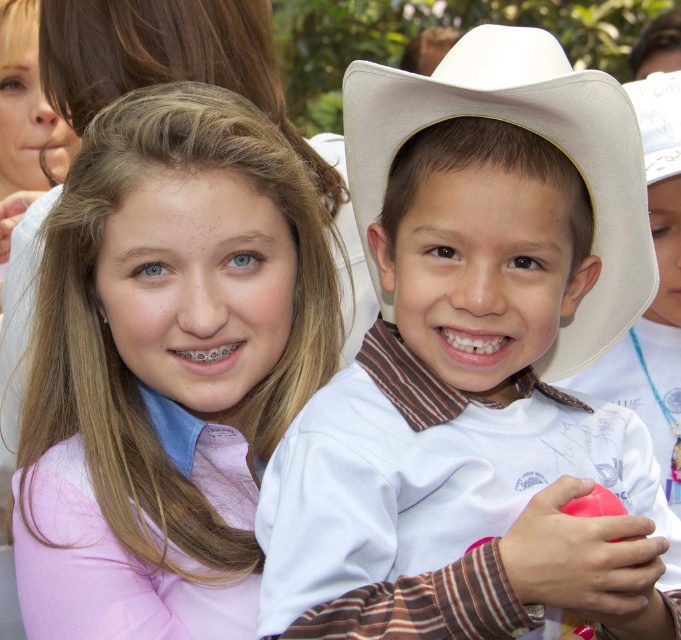
Does pink fabric shirt at upper left have a greater width compared to white cotton cowboy hat at center?

Yes, pink fabric shirt at upper left is wider than white cotton cowboy hat at center.

What do you see at coordinates (165, 368) in the screenshot?
I see `pink fabric shirt at upper left` at bounding box center [165, 368].

This screenshot has height=640, width=681. In order to click on pink fabric shirt at upper left in this screenshot , I will do `click(165, 368)`.

Does point (633, 268) lie in front of point (659, 88)?

Yes, it is in front of point (659, 88).

Is white felt cowboy hat at center thinner than white cotton cowboy hat at center?

In fact, white felt cowboy hat at center might be wider than white cotton cowboy hat at center.

Between point (567, 141) and point (624, 404), which one is positioned in front?

Point (567, 141) is in front.

Find the location of a particular element. Image resolution: width=681 pixels, height=640 pixels. white felt cowboy hat at center is located at coordinates pos(533,131).

Who is positioned more to the right, white matte cowboy hat at upper right or white cotton cowboy hat at center?

From the viewer's perspective, white cotton cowboy hat at center appears more on the right side.

The width and height of the screenshot is (681, 640). In order to click on white matte cowboy hat at upper right in this screenshot , I will do `click(477, 369)`.